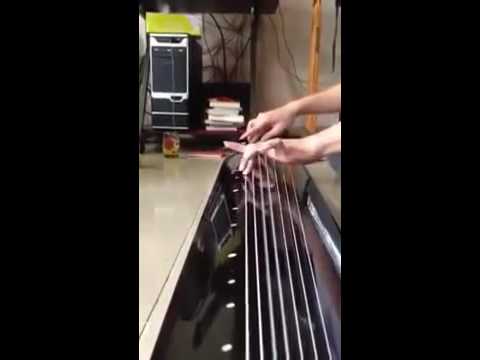
At what (x,y) coordinates should I click in order to perform the action: click on floor. Please return your answer as a coordinate pair (x, y). Looking at the image, I should click on pos(157,200).